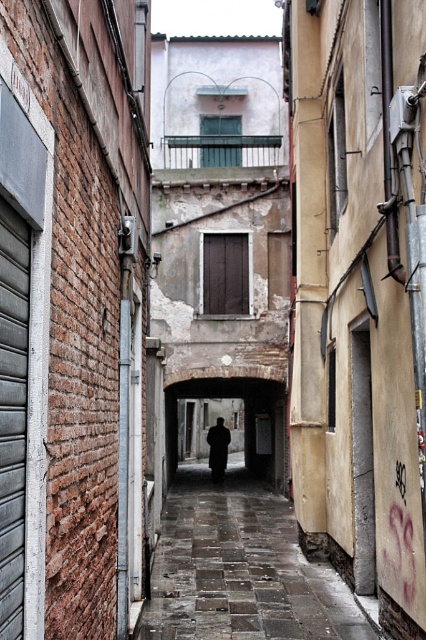
Is dark gray stone path at center behind dark wool coat at center?

No, dark gray stone path at center is in front of dark wool coat at center.

Find the location of a particular element. This screenshot has height=640, width=426. dark gray stone path at center is located at coordinates (239, 566).

Identify the location of dark gray stone path at center. The width and height of the screenshot is (426, 640). (239, 566).